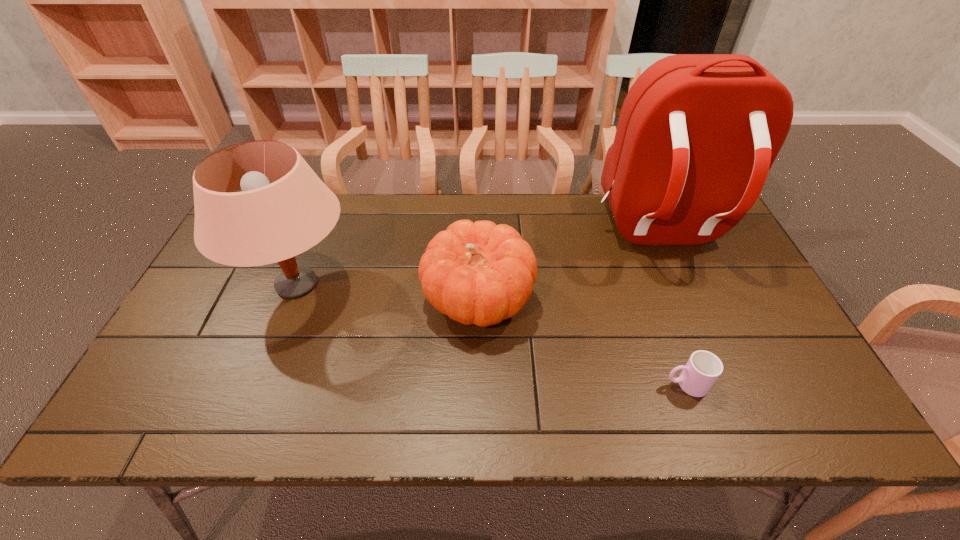
At what (x,y) coordinates should I click in order to perform the action: click on backpack. Please return your answer as a coordinate pair (x, y). Looking at the image, I should click on (697, 135).

What are the coordinates of `lampshade` in the screenshot? It's located at (266, 223).

This screenshot has height=540, width=960. In order to click on the third shortest object in this screenshot , I will do `click(266, 223)`.

This screenshot has height=540, width=960. Find the location of `the second object from left to right`. the second object from left to right is located at coordinates (480, 273).

Identify the location of the third tallest object. (480, 273).

The height and width of the screenshot is (540, 960). I want to click on cup, so click(x=703, y=368).

This screenshot has width=960, height=540. Find the location of `the shortest object`. the shortest object is located at coordinates (703, 368).

Locate an element on the screen. The image size is (960, 540). free space located 0.210m on the strap side of the tallest object is located at coordinates (x=703, y=334).

The height and width of the screenshot is (540, 960). What are the coordinates of `free region located on the front-facing side of the lampshade` in the screenshot? It's located at (387, 285).

This screenshot has height=540, width=960. Find the location of `vacant space located on the right of the third object from right to left`. vacant space located on the right of the third object from right to left is located at coordinates (589, 300).